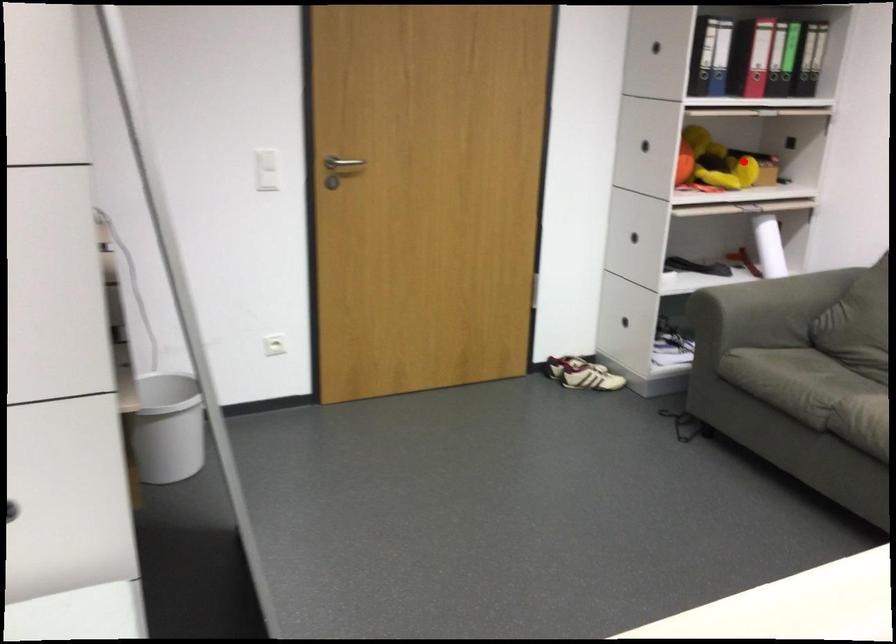
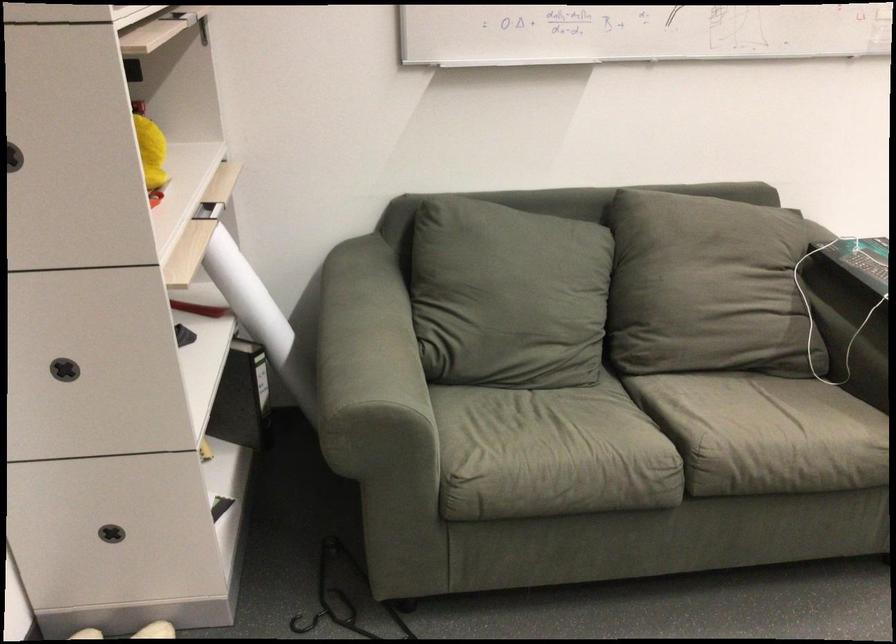
Question: I am providing you with two images of the same scene from different viewpoints. Given a red point in image1, look at the same physical point in image2. Is it:

Choices:
 (A) Closer to the viewpoint
 (B) Farther from the viewpoint

Answer: (A)